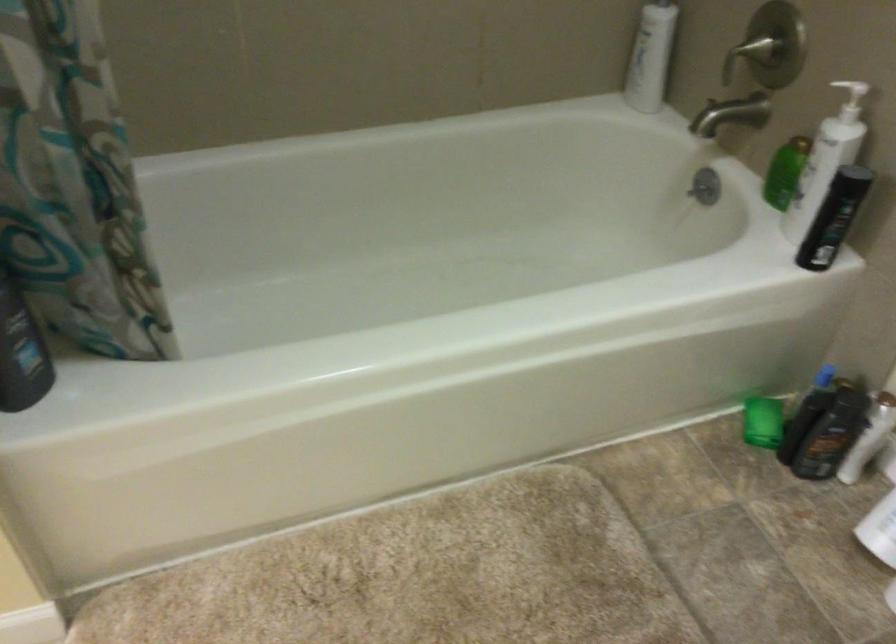
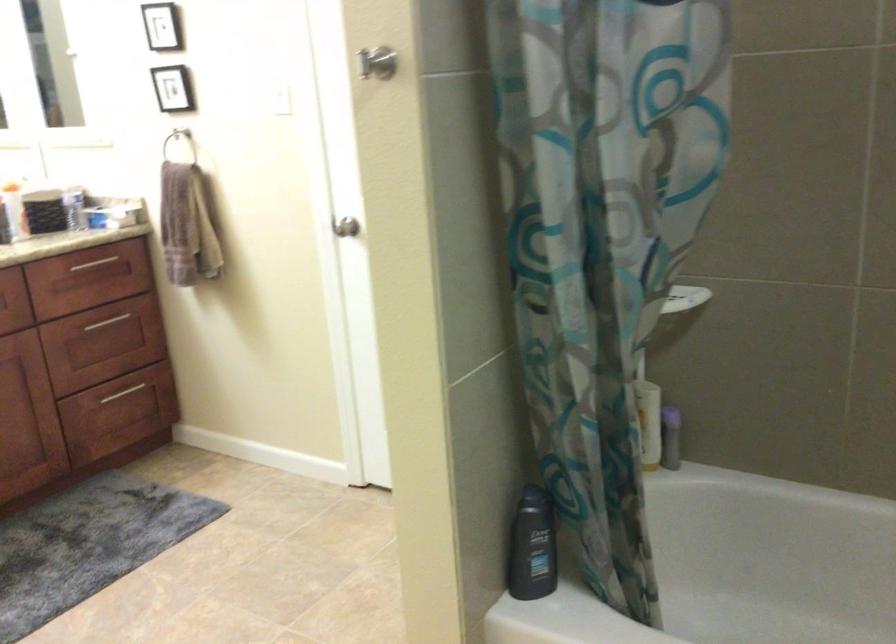
Question: The camera is either moving clockwise (left) or counter-clockwise (right) around the object. The first image is from the beginning of the video and the second image is from the end. Is the camera moving left or right when shooting the video?

Choices:
 (A) Left
 (B) Right

Answer: (B)